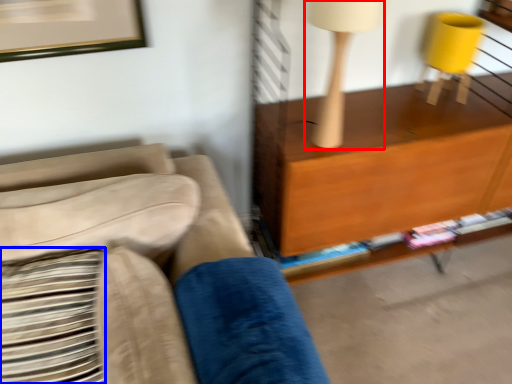
Question: Which object appears closest to the camera in this image, table lamp (highlighted by a red box) or pillow (highlighted by a blue box)?

Choices:
 (A) table lamp
 (B) pillow

Answer: (B)